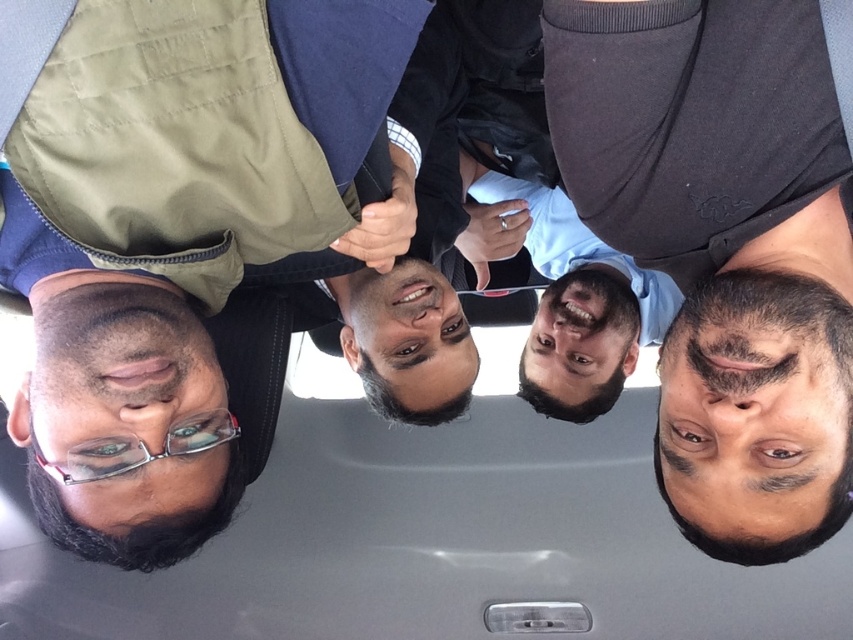
Question: Estimate the real-world distances between objects in this image. Which object is closer to the matte black hand at center?

Choices:
 (A) dark gray matte shirt at upper right
 (B) matte black phone at center

Answer: (A)

Question: Which of the following is the farthest from the observer?

Choices:
 (A) (784, 144)
 (B) (403, 195)
 (C) (521, 240)

Answer: (C)

Question: Which object is positioned closest to the matte black hand at center?

Choices:
 (A) matte black phone at center
 (B) dark gray matte shirt at upper right

Answer: (B)

Question: Is dark gray matte shirt at upper right positioned in front of matte black phone at center?

Choices:
 (A) no
 (B) yes

Answer: (B)

Question: Is matte black hand at center to the right of matte black phone at center from the viewer's perspective?

Choices:
 (A) no
 (B) yes

Answer: (A)

Question: Is matte black hand at center below matte black phone at center?

Choices:
 (A) no
 (B) yes

Answer: (B)